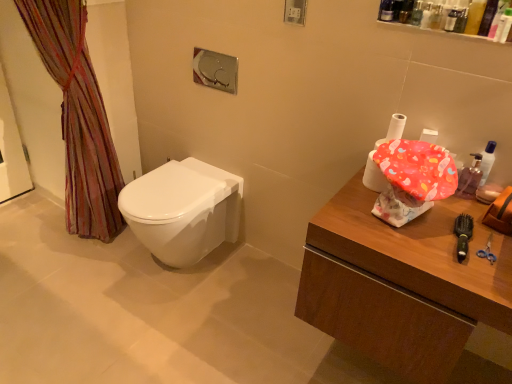
What are the coordinates of `vacant space underneath white glossy toilet at center (from a real-world perspective)` in the screenshot? It's located at (176, 269).